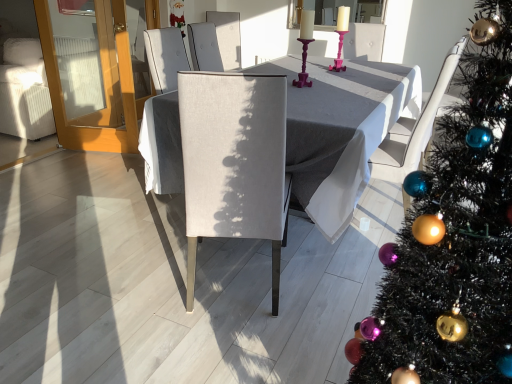
Question: Is there a large distance between matte gray chair at center and matte gray table at center?

Choices:
 (A) yes
 (B) no

Answer: (B)

Question: Is the surface of matte gray chair at center in direct contact with matte gray table at center?

Choices:
 (A) no
 (B) yes

Answer: (A)

Question: Considering the relative sizes of matte gray chair at center and matte gray table at center in the image provided, is matte gray chair at center wider than matte gray table at center?

Choices:
 (A) yes
 (B) no

Answer: (B)

Question: Does matte gray chair at center have a lesser width compared to matte gray table at center?

Choices:
 (A) yes
 (B) no

Answer: (A)

Question: Considering the relative positions of matte gray chair at center and matte gray table at center in the image provided, is matte gray chair at center behind matte gray table at center?

Choices:
 (A) no
 (B) yes

Answer: (A)

Question: From a real-world perspective, is matte gray chair at center positioned above or below transparent glass door at left?

Choices:
 (A) above
 (B) below

Answer: (B)

Question: Looking at their shapes, would you say matte gray chair at center is wider or thinner than transparent glass door at left?

Choices:
 (A) thin
 (B) wide

Answer: (B)

Question: In the image, is matte gray chair at center on the left side or the right side of transparent glass door at left?

Choices:
 (A) left
 (B) right

Answer: (B)

Question: From the image's perspective, is matte gray chair at center above or below transparent glass door at left?

Choices:
 (A) above
 (B) below

Answer: (B)

Question: Visually, is matte glass candlesticks at upper center positioned to the left or to the right of transparent glass door at left?

Choices:
 (A) left
 (B) right

Answer: (B)

Question: Considering the positions of matte glass candlesticks at upper center and transparent glass door at left in the image, is matte glass candlesticks at upper center wider or thinner than transparent glass door at left?

Choices:
 (A) thin
 (B) wide

Answer: (A)

Question: Considering the positions of matte glass candlesticks at upper center and transparent glass door at left in the image, is matte glass candlesticks at upper center bigger or smaller than transparent glass door at left?

Choices:
 (A) big
 (B) small

Answer: (B)

Question: From the image's perspective, relative to transparent glass door at left, is matte glass candlesticks at upper center above or below?

Choices:
 (A) below
 (B) above

Answer: (B)

Question: Considering the positions of matte gray table at center and pink plastic candle holder at center in the image, is matte gray table at center bigger or smaller than pink plastic candle holder at center?

Choices:
 (A) big
 (B) small

Answer: (A)

Question: From a real-world perspective, is matte gray table at center positioned above or below pink plastic candle holder at center?

Choices:
 (A) above
 (B) below

Answer: (B)